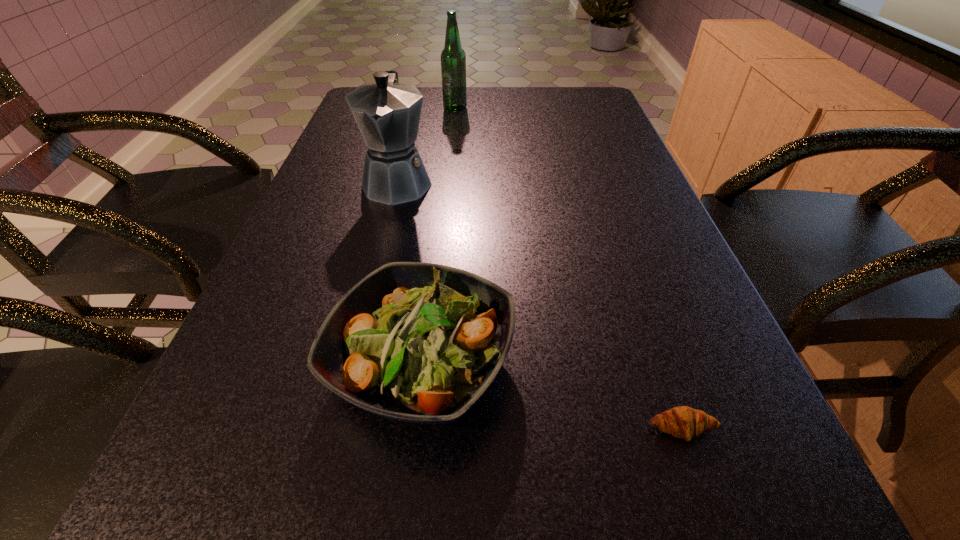
Where is `vacant space that satisfies the following two spatial constraints: 1. at the spout of the coffeepot; 2. on the left side of the salad plate`? The image size is (960, 540). vacant space that satisfies the following two spatial constraints: 1. at the spout of the coffeepot; 2. on the left side of the salad plate is located at coordinates (353, 362).